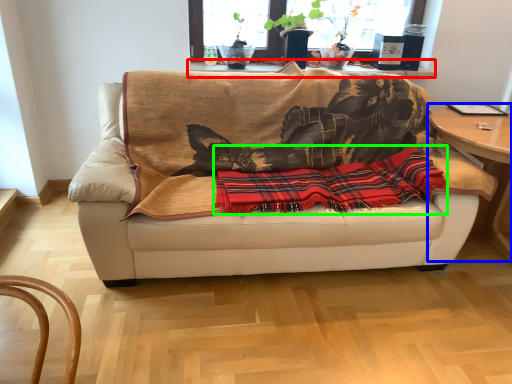
Question: Which is farther away from table (highlighted by a red box)? table (highlighted by a blue box) or plaid (highlighted by a green box)?

Choices:
 (A) table
 (B) plaid

Answer: (A)